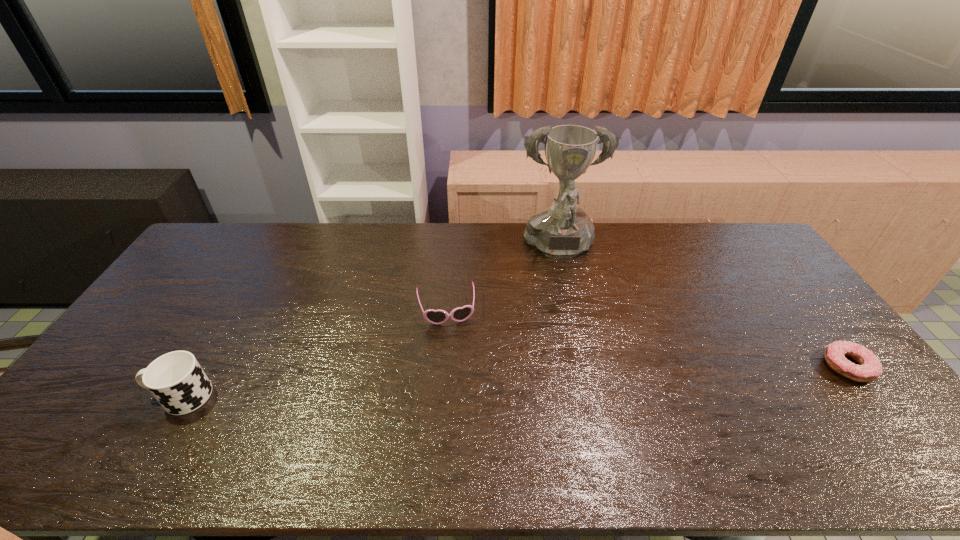
The width and height of the screenshot is (960, 540). What are the coordinates of `vacant area that lies between the award and the doughnut` in the screenshot? It's located at (704, 308).

Where is `vacant area that lies between the leftmost object and the doughnut`? This screenshot has width=960, height=540. vacant area that lies between the leftmost object and the doughnut is located at coordinates (515, 381).

The width and height of the screenshot is (960, 540). What are the coordinates of `free point between the farthest object and the cup` in the screenshot? It's located at (371, 323).

Where is `vacant space in between the rightmost object and the farthest object`? The height and width of the screenshot is (540, 960). vacant space in between the rightmost object and the farthest object is located at coordinates point(704,308).

Locate an element on the screen. The height and width of the screenshot is (540, 960). free space between the leftmost object and the tallest object is located at coordinates (371, 323).

Identify the location of free space between the cup and the doughnut. This screenshot has height=540, width=960. (515, 381).

You are a GUI agent. You are given a task and a screenshot of the screen. Output one action in this format:
    pyautogui.click(x=<x>, y=<y>)
    Task: Click on the free spot between the second farthest object and the cup
    Image resolution: width=960 pixels, height=540 pixels.
    Given the screenshot: What is the action you would take?
    pyautogui.click(x=314, y=353)

Choose which object is the third nearest neighbor to the shortest object. Please provide its 2D coordinates. Your answer should be formatted as a tuple, i.e. [(x, y)], where the tuple contains the x and y coordinates of a point satisfying the conditions above.

[(176, 380)]

Select which object is the third closest to the shortest object. Please provide its 2D coordinates. Your answer should be formatted as a tuple, i.e. [(x, y)], where the tuple contains the x and y coordinates of a point satisfying the conditions above.

[(176, 380)]

This screenshot has width=960, height=540. I want to click on free space that satisfies the following two spatial constraints: 1. on the back side of the second object from left to right; 2. on the right side of the farthest object, so click(x=451, y=249).